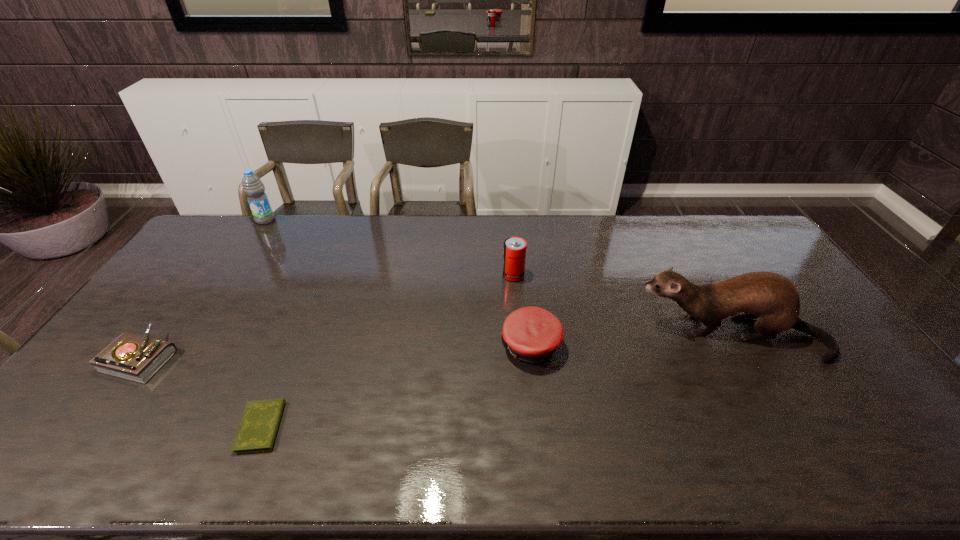
The image size is (960, 540). In order to click on free spot between the farthest object and the rightmost object in this screenshot , I will do `click(498, 278)`.

Where is `vacant area between the farthest object and the farther diary`? This screenshot has width=960, height=540. vacant area between the farthest object and the farther diary is located at coordinates (204, 289).

In order to click on unoccupied area between the ferret and the third tallest object in this screenshot , I will do `click(622, 305)`.

The height and width of the screenshot is (540, 960). I want to click on vacant area that lies between the farther diary and the rightmost object, so click(x=436, y=346).

This screenshot has width=960, height=540. What are the coordinates of `vacant region between the left diary and the third shortest object` in the screenshot? It's located at (337, 352).

I want to click on vacant point located between the cap and the water bottle, so click(x=398, y=283).

Where is `vacant space that's between the rightmost object and the water bottle`? The width and height of the screenshot is (960, 540). vacant space that's between the rightmost object and the water bottle is located at coordinates (498, 278).

Find the location of a particular element. Image resolution: width=960 pixels, height=540 pixels. free point between the cap and the farthest object is located at coordinates (398, 283).

Locate an element on the screen. Image resolution: width=960 pixels, height=540 pixels. object that is the fifth closest to the fourth shortest object is located at coordinates (133, 357).

Choose which object is the third nearest neighbor to the rightmost object. Please provide its 2D coordinates. Your answer should be formatted as a tuple, i.e. [(x, y)], where the tuple contains the x and y coordinates of a point satisfying the conditions above.

[(258, 427)]